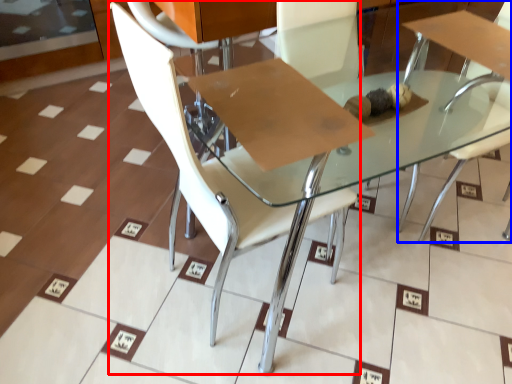
Question: Among these objects, which one is farthest to the camera, chair (highlighted by a red box) or chair (highlighted by a blue box)?

Choices:
 (A) chair
 (B) chair

Answer: (B)